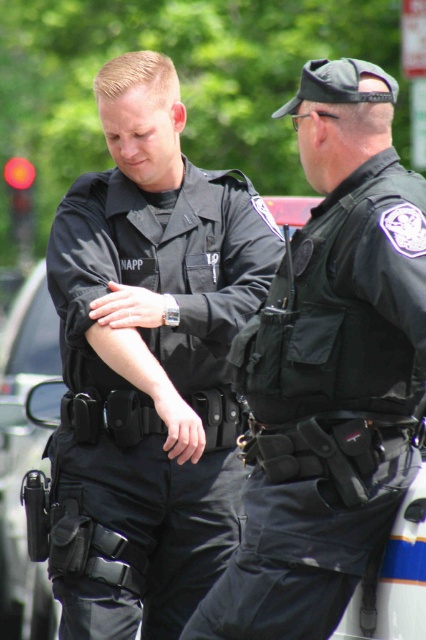
Does black matte uniform at center have a smaller size compared to black tactical vest at center?

No.

Does black matte uniform at center appear on the left side of black tactical vest at center?

Yes, black matte uniform at center is to the left of black tactical vest at center.

Is point (215, 250) positioned after point (402, 339)?

Yes, it is.

Where is `black matte uniform at center`? The height and width of the screenshot is (640, 426). black matte uniform at center is located at coordinates (152, 388).